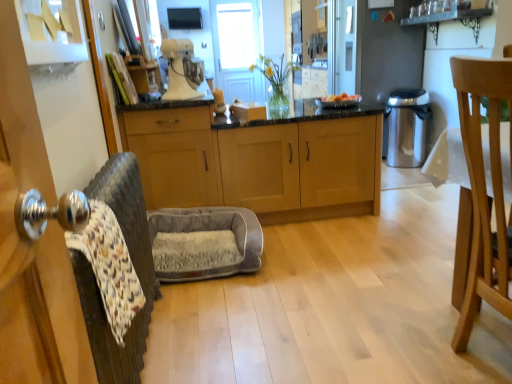
This screenshot has height=384, width=512. What are the coordinates of `space that is in front of light brown wood cabinets at center, acting as the first cabinetry starting from the right` in the screenshot? It's located at click(335, 253).